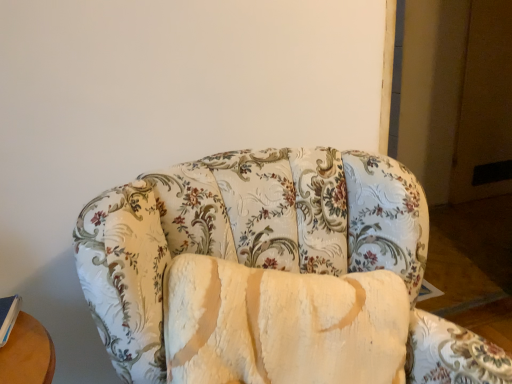
Question: In the image, is blue hardcover book at lower left on the left side or the right side of floral fabric couch at center?

Choices:
 (A) right
 (B) left

Answer: (B)

Question: Relative to floral fabric couch at center, is blue hardcover book at lower left in front or behind?

Choices:
 (A) front
 (B) behind

Answer: (B)

Question: Looking at the image, does blue hardcover book at lower left seem bigger or smaller compared to floral fabric couch at center?

Choices:
 (A) big
 (B) small

Answer: (B)

Question: From the image's perspective, is floral fabric couch at center above or below blue hardcover book at lower left?

Choices:
 (A) above
 (B) below

Answer: (B)

Question: Does point (271, 274) appear closer or farther from the camera than point (10, 329)?

Choices:
 (A) farther
 (B) closer

Answer: (B)

Question: In the image, is floral fabric couch at center positioned in front of or behind blue hardcover book at lower left?

Choices:
 (A) front
 (B) behind

Answer: (A)

Question: In terms of size, does floral fabric couch at center appear bigger or smaller than blue hardcover book at lower left?

Choices:
 (A) big
 (B) small

Answer: (A)